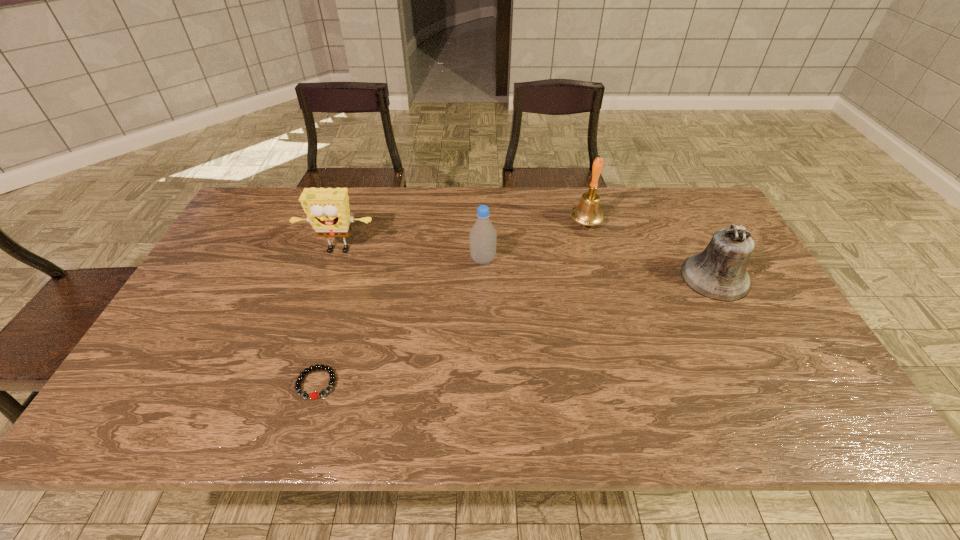
I want to click on vacant space at the far left corner, so click(x=257, y=226).

In the image, there is a desktop. Where is `free region at the far right corner`? The height and width of the screenshot is (540, 960). free region at the far right corner is located at coordinates (703, 204).

Locate an element on the screen. The height and width of the screenshot is (540, 960). free space between the farther bell and the shortest object is located at coordinates (451, 302).

I want to click on vacant area that lies between the third object from left to right and the right bell, so click(599, 268).

You are a GUI agent. You are given a task and a screenshot of the screen. Output one action in this format:
    pyautogui.click(x=<x>, y=<y>)
    Task: Click on the unoccupied area between the left bell and the sponge
    
    Given the screenshot: What is the action you would take?
    pyautogui.click(x=462, y=237)

Where is `unoccupied area between the third object from left to right and the sponge`? unoccupied area between the third object from left to right and the sponge is located at coordinates (410, 255).

Find the location of a particular element. Image resolution: width=960 pixels, height=540 pixels. vacant space in between the farthest object and the third object from right to left is located at coordinates (535, 241).

Locate an element on the screen. free point between the sponge and the nearer bell is located at coordinates (526, 265).

The image size is (960, 540). What are the coordinates of `free space that is in between the right bell and the sponge` in the screenshot? It's located at (526, 265).

The width and height of the screenshot is (960, 540). In order to click on empty location between the bottle and the nearest object in this screenshot , I will do `click(399, 321)`.